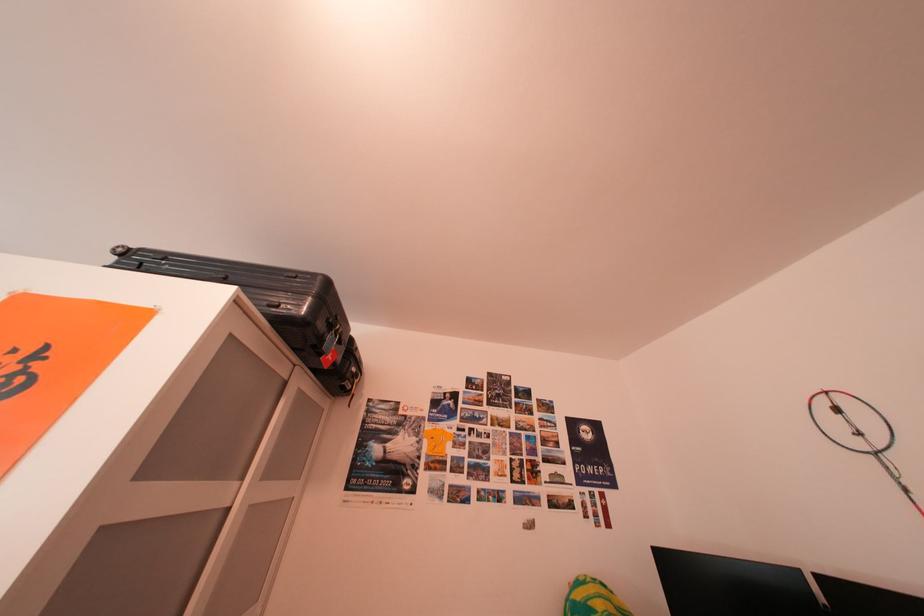
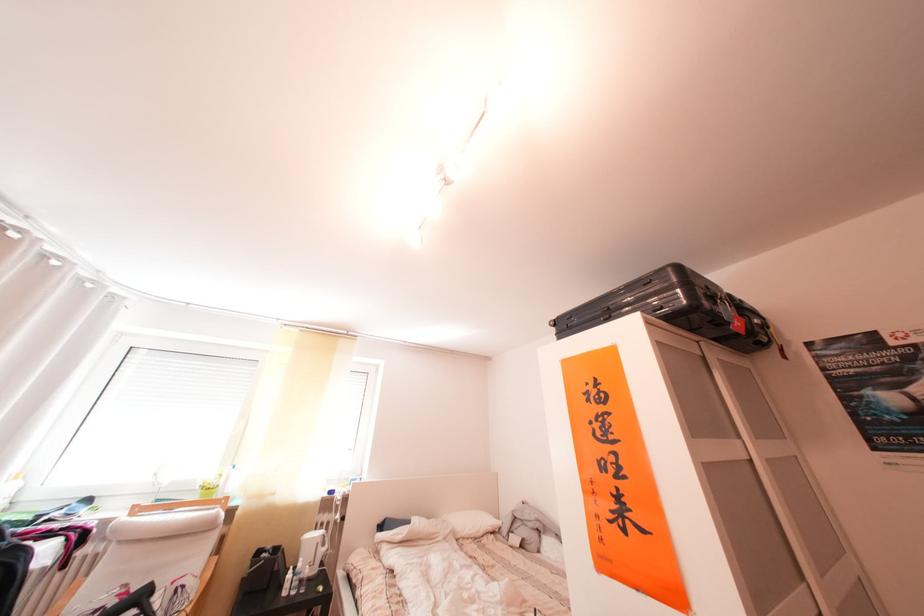
The point at [256,483] is marked in the first image. Where is the corresponding point in the second image?

(751, 442)